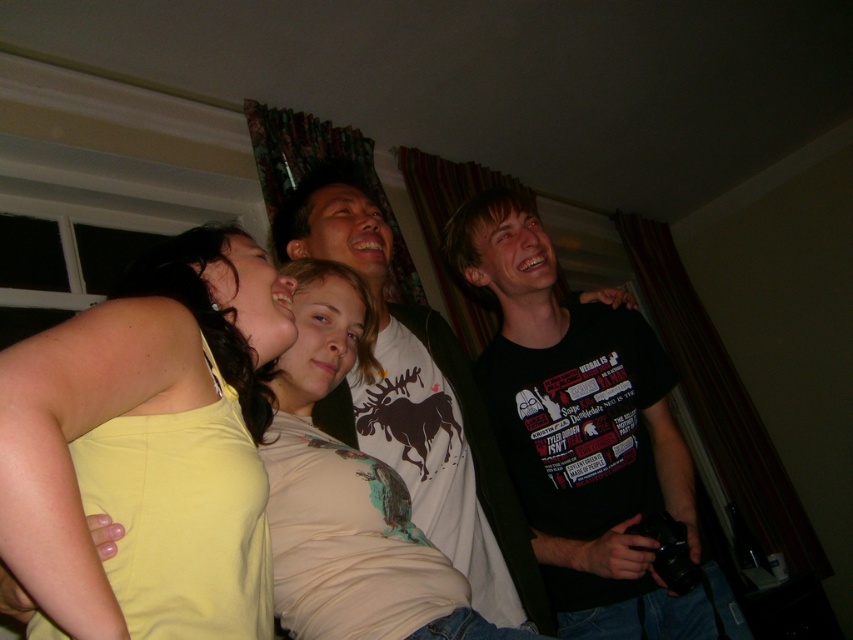
Between black matte t-shirt at right and yellow fabric at left, which one is positioned higher?

yellow fabric at left

Who is lower down, black matte t-shirt at right or yellow fabric at left?

Positioned lower is black matte t-shirt at right.

Locate an element on the screen. The width and height of the screenshot is (853, 640). black matte t-shirt at right is located at coordinates (584, 435).

Is yellow fabric at left taller than white matte t-shirt at center?

No, yellow fabric at left is not taller than white matte t-shirt at center.

Which is more to the right, yellow fabric at left or white matte t-shirt at center?

white matte t-shirt at center

Between point (134, 410) and point (520, 508), which one is positioned in front?

Point (134, 410) is more forward.

Image resolution: width=853 pixels, height=640 pixels. What are the coordinates of `yellow fabric at left` in the screenshot? It's located at (126, 396).

Between black matte t-shirt at right and white matte t-shirt at center, which one has more height?

white matte t-shirt at center

Is black matte t-shirt at right positioned in front of white matte t-shirt at center?

No.

This screenshot has width=853, height=640. Identify the location of black matte t-shirt at right. (584, 435).

Where is `black matte t-shirt at right`? black matte t-shirt at right is located at coordinates (584, 435).